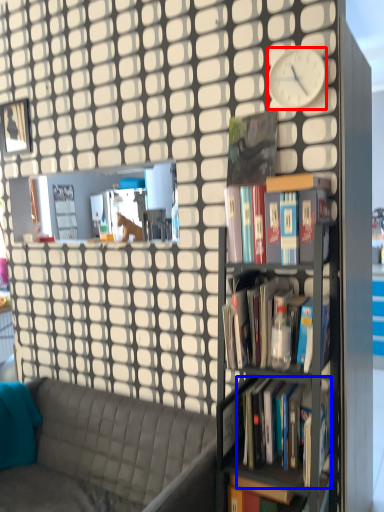
Question: Which object appears closest to the camera in this image, clock (highlighted by a red box) or book (highlighted by a blue box)?

Choices:
 (A) clock
 (B) book

Answer: (B)